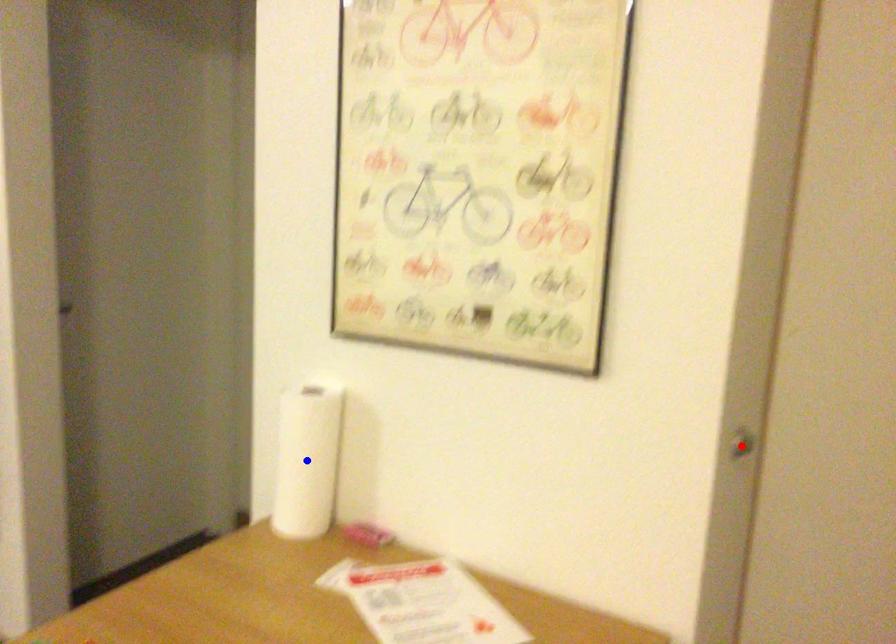
Question: In the image, two points are highlighted. Which point is nearer to the camera? Reply with the corresponding letter.

Choices:
 (A) blue point
 (B) red point

Answer: (B)